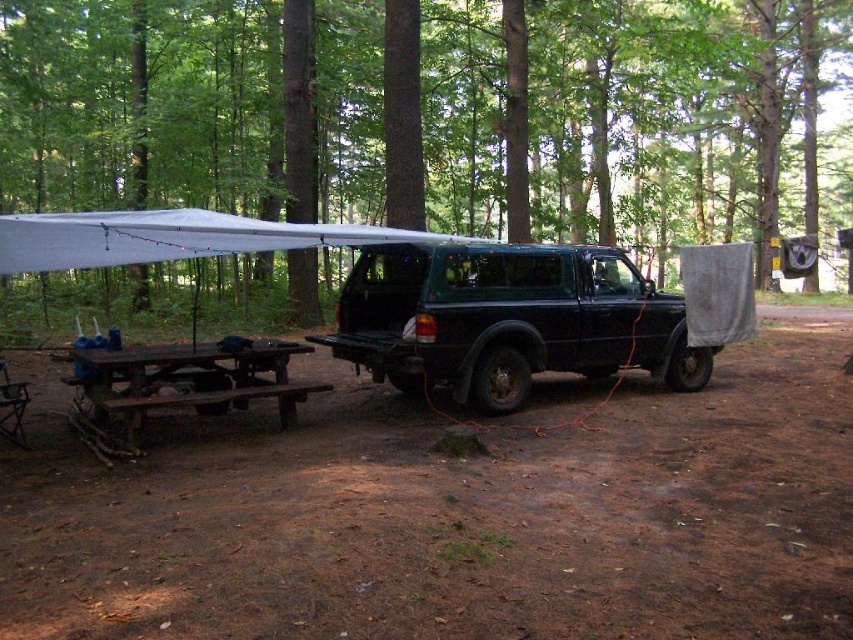
Which is more to the left, green matte tree at center or black matte jeep at center?

Positioned to the left is black matte jeep at center.

This screenshot has height=640, width=853. Describe the element at coordinates (184, 106) in the screenshot. I see `green matte tree at center` at that location.

Find the location of `green matte tree at center`. green matte tree at center is located at coordinates (184, 106).

Can you confirm if green matte tree at center is positioned to the left of brown wooden picnic table at lower left?

In fact, green matte tree at center is to the right of brown wooden picnic table at lower left.

Is green matte tree at center above brown wooden picnic table at lower left?

Correct, green matte tree at center is located above brown wooden picnic table at lower left.

What do you see at coordinates (184, 106) in the screenshot?
I see `green matte tree at center` at bounding box center [184, 106].

The height and width of the screenshot is (640, 853). I want to click on green matte tree at center, so click(x=184, y=106).

Based on the photo, is black matte jeep at center closer to the viewer compared to brown wooden picnic table at lower left?

No.

The image size is (853, 640). Describe the element at coordinates (508, 320) in the screenshot. I see `black matte jeep at center` at that location.

Is point (531, 362) positioned in front of point (186, 352)?

No.

Find the location of a particular element. black matte jeep at center is located at coordinates click(x=508, y=320).